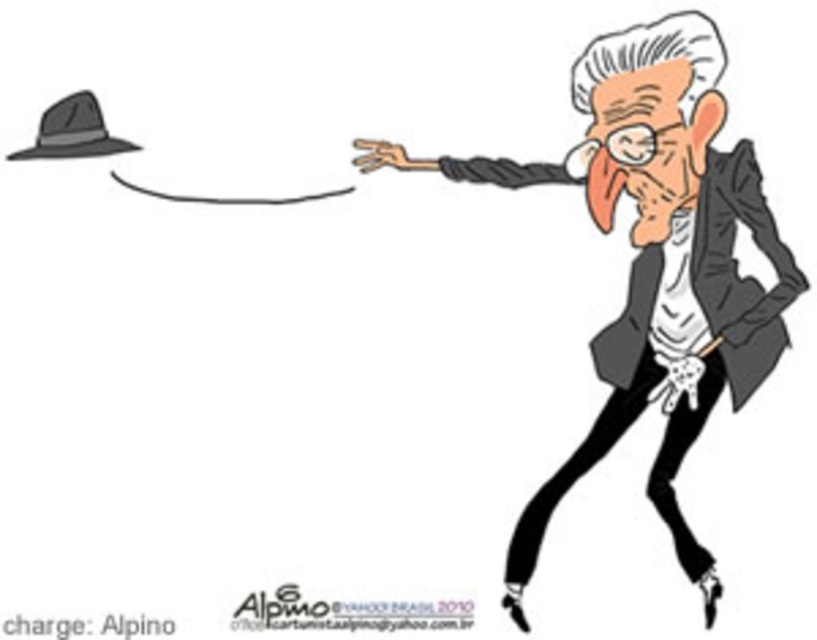
Based on the scene description, which object is wider, the matte black business suit at right or the dark gray felt hat at upper left?

The matte black business suit at right is wider than the dark gray felt hat at upper left according to the description.

You are an interior designer measuring the distance between the gray matte hat at upper left and the matte black business suit at right for a client. The client requires the items to be at least 5 inches apart. Can you confirm if the current placement meets the requirement?

The gray matte hat at upper left is 4.64 inches from matte black business suit at right, which is less than the required 5 inches. The current placement does not meet the client requirement.